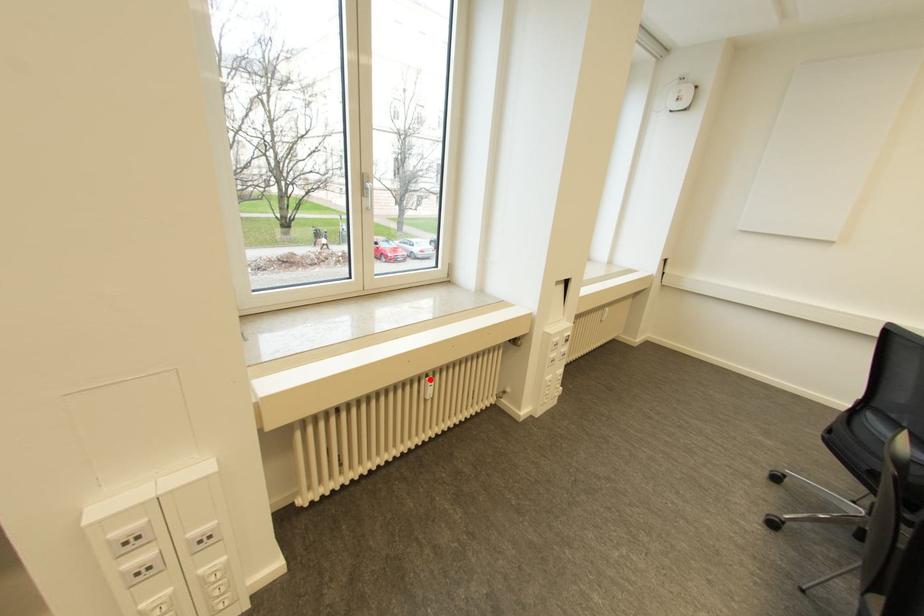
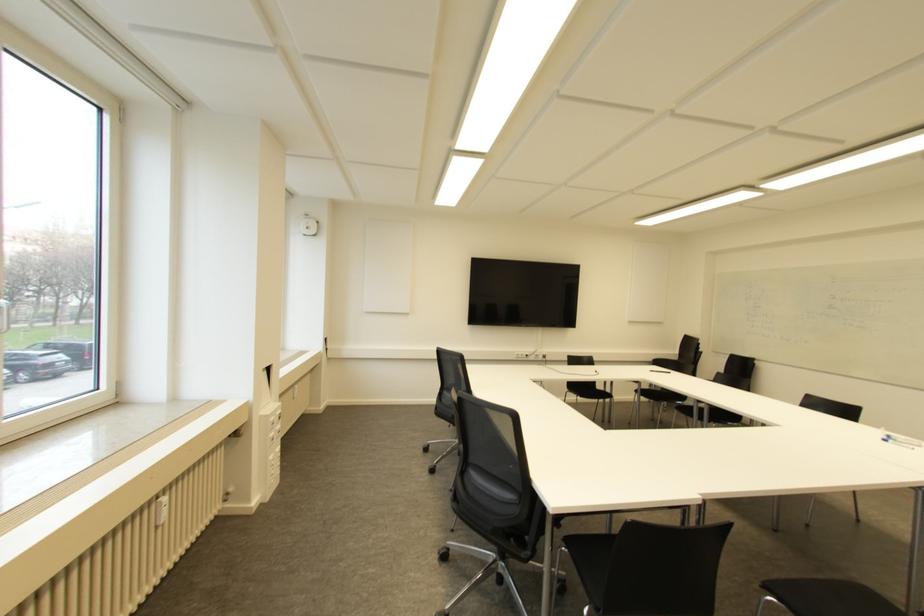
Question: I am providing you with two images of the same scene from different viewpoints. Given a red point in image1, look at the same physical point in image2. Is it:

Choices:
 (A) Closer to the viewpoint
 (B) Farther from the viewpoint

Answer: (A)